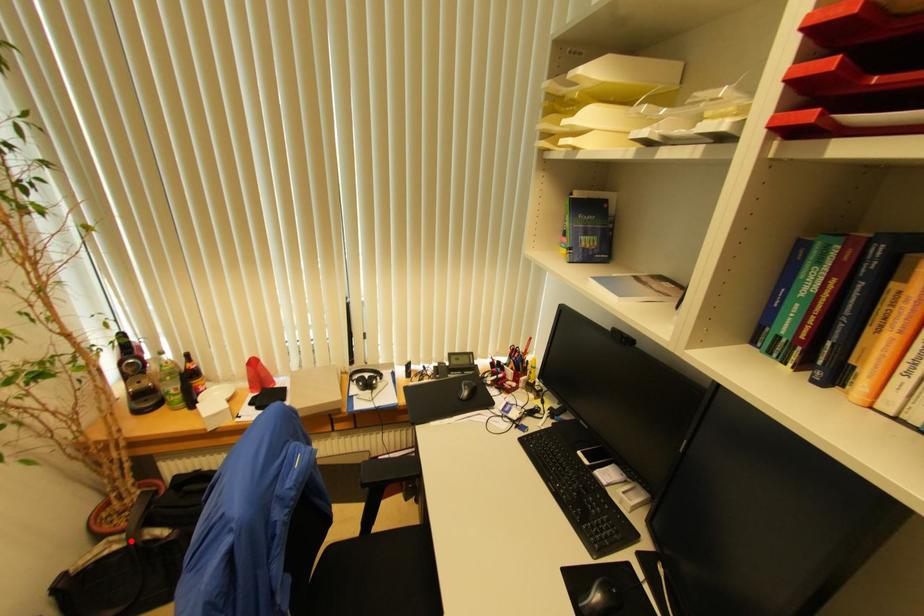
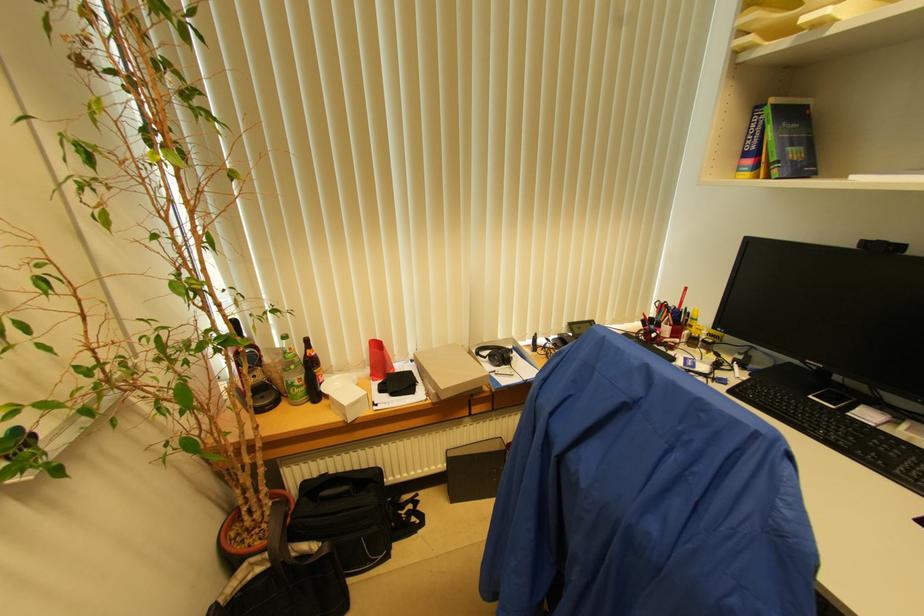
In the second image, find the point that corresponds to the highlighted location in the first image.

(273, 561)